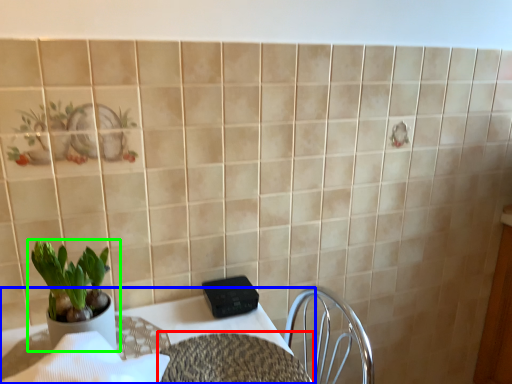
Question: Estimate the real-world distances between objects in this image. Which object is farther from round table (highlighted by a red box), table (highlighted by a blue box) or houseplant (highlighted by a green box)?

Choices:
 (A) table
 (B) houseplant

Answer: (B)